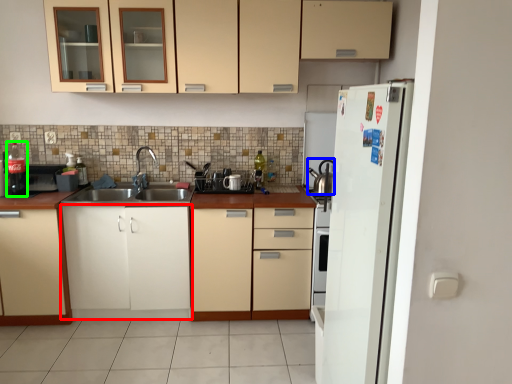
Question: Based on their relative distances, which object is farther from cabinetry (highlighted by a red box)? Choose from tea pot (highlighted by a blue box) and bottle (highlighted by a green box).

Choices:
 (A) tea pot
 (B) bottle

Answer: (A)